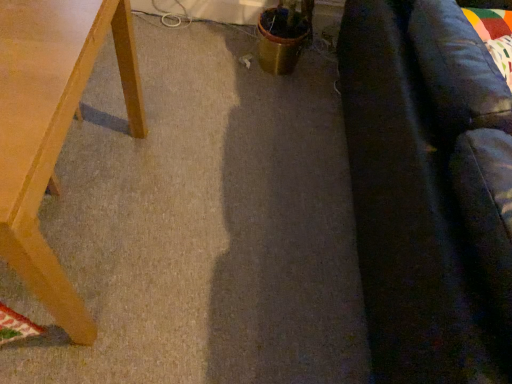
Question: From their relative heights in the image, would you say dark gray fabric couch at right is taller or shorter than light brown wooden table at left?

Choices:
 (A) tall
 (B) short

Answer: (A)

Question: Looking at their shapes, would you say dark gray fabric couch at right is wider or thinner than light brown wooden table at left?

Choices:
 (A) wide
 (B) thin

Answer: (A)

Question: Considering their positions, is dark gray fabric couch at right located in front of or behind light brown wooden table at left?

Choices:
 (A) front
 (B) behind

Answer: (A)

Question: Based on their positions, is light brown wooden table at left located to the left or right of dark gray fabric couch at right?

Choices:
 (A) right
 (B) left

Answer: (B)

Question: Is light brown wooden table at left situated inside dark gray fabric couch at right or outside?

Choices:
 (A) inside
 (B) outside

Answer: (B)

Question: From the image's perspective, relative to dark gray fabric couch at right, is light brown wooden table at left above or below?

Choices:
 (A) below
 (B) above

Answer: (A)

Question: From a real-world perspective, is light brown wooden table at left above or below dark gray fabric couch at right?

Choices:
 (A) below
 (B) above

Answer: (A)